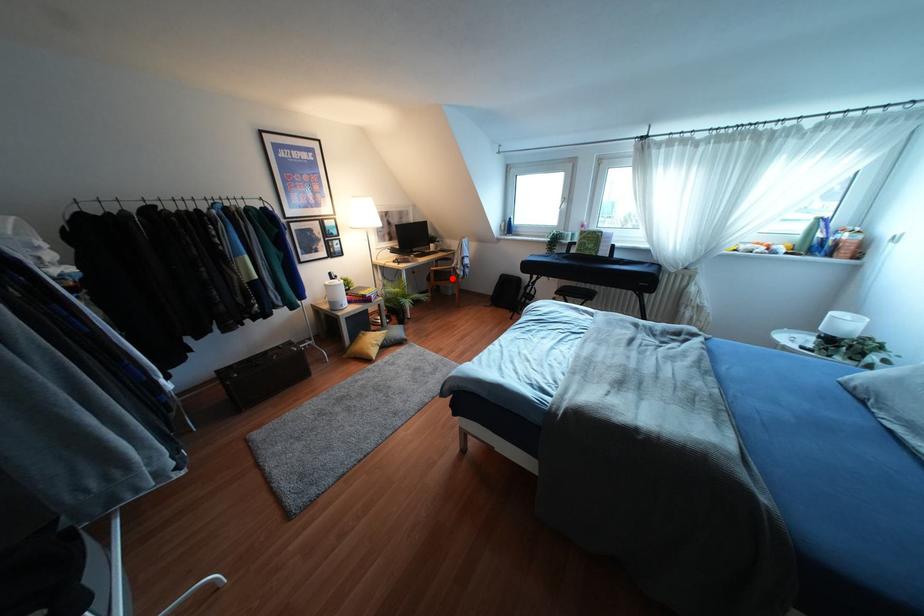
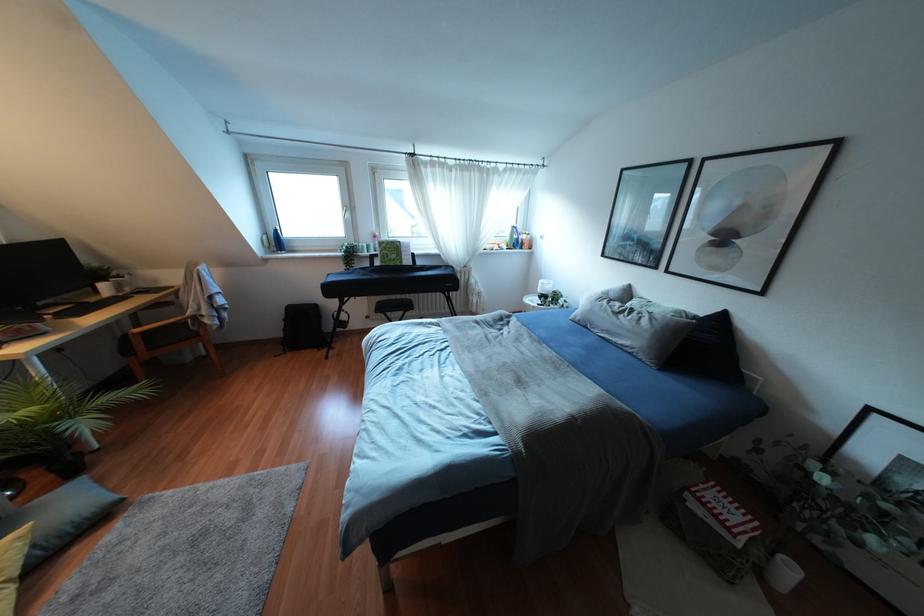
Question: I am providing you with two images of the same scene from different viewpoints. Given a red point in image1, look at the same physical point in image2. Is it:

Choices:
 (A) Closer to the viewpoint
 (B) Farther from the viewpoint

Answer: (B)